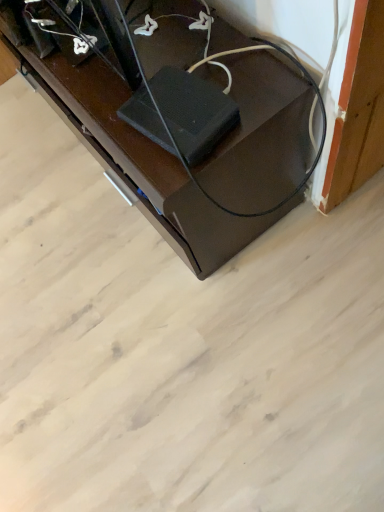
Find the location of a particular element. The image size is (384, 512). empty space that is ontop of black rubber speaker at center (from a real-world perspective) is located at coordinates (175, 108).